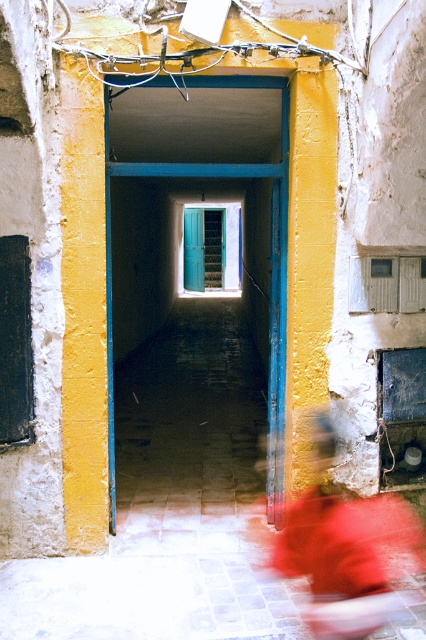
Question: Among these points, which one is farthest from the camera?

Choices:
 (A) (382, 593)
 (B) (207, 252)
 (C) (195, 168)

Answer: (B)

Question: Is red fabric at lower right above blue wooden door at center?

Choices:
 (A) yes
 (B) no

Answer: (B)

Question: Which of the following is the farthest from the observer?

Choices:
 (A) (207, 237)
 (B) (282, 168)
 (C) (325, 560)

Answer: (A)

Question: Which of the following is the farthest from the observer?

Choices:
 (A) (109, 509)
 (B) (195, 289)
 (C) (287, 572)

Answer: (B)

Question: Considering the relative positions of red fabric at lower right and blue wooden door at center in the image provided, where is red fabric at lower right located with respect to blue wooden door at center?

Choices:
 (A) above
 (B) below

Answer: (B)

Question: Is red fabric at lower right thinner than teal wooden door at center?

Choices:
 (A) yes
 (B) no

Answer: (B)